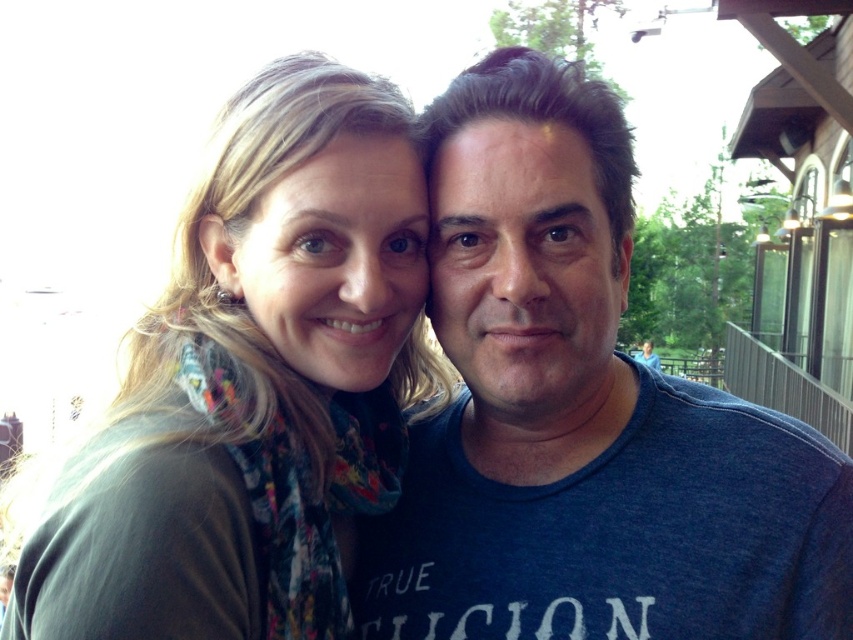
You are standing at the point labeled as point (563, 108) in the image. You want to toss a small ball to a friend who is standing exactly where the viewer is positioned. If the ball travels in a straight line, will it pass directly between the two people in the photo?

The point labeled as point (563, 108) is 1.70 meters away from the viewer. Since the two people in the photo are standing close together, the ball tossed in a straight line from the point to the viewer would pass directly between them if they are positioned along that path. However, without knowing their exact positions relative to the straight line, we cannot confirm this with certainty. The answer depends on whether the two people are aligned along the path between the point and the viewer.

You are a photographer adjusting your camera to focus on two points in the scene. The first point is at coordinate point (560, 568) and the second is at point (260, 176). Which point should you focus on first if you want to capture the closest object to the camera?

Point (560, 568) is further to the viewer than point (260, 176), so you should focus on point (260, 176) first as it is closer to the camera.